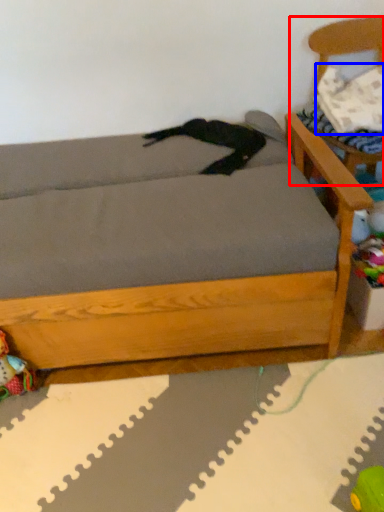
Question: Which object is further to the camera taking this photo, armchair (highlighted by a red box) or pillow (highlighted by a blue box)?

Choices:
 (A) armchair
 (B) pillow

Answer: (B)